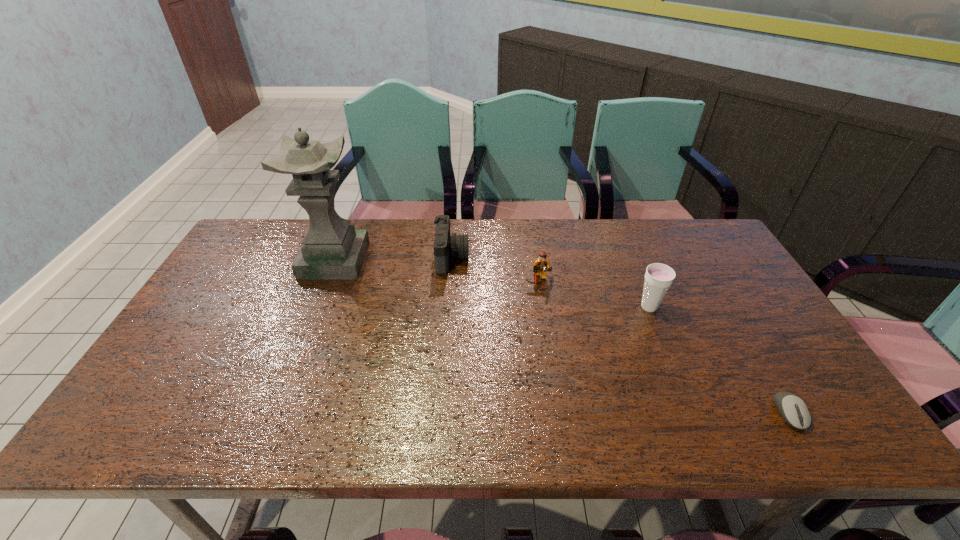
In the image, there is a desktop. Identify the location of vacant space at the left edge. (179, 376).

At what (x,y) coordinates should I click in order to perform the action: click on blank area at the right edge. Please return your answer as a coordinate pair (x, y). This screenshot has height=540, width=960. Looking at the image, I should click on (729, 326).

Where is `vacant space at the far right corner`? The width and height of the screenshot is (960, 540). vacant space at the far right corner is located at coordinates (730, 260).

Where is `empty space that is in between the rightmost object and the second object from left to right`? empty space that is in between the rightmost object and the second object from left to right is located at coordinates (620, 335).

Locate an element on the screen. The image size is (960, 540). vacant space that is in between the Lego and the fourth object from right to left is located at coordinates (495, 269).

Locate an element on the screen. The width and height of the screenshot is (960, 540). vacant space that's between the fourth tallest object and the second object from right to left is located at coordinates (593, 294).

This screenshot has height=540, width=960. I want to click on free space between the cup and the second shortest object, so click(x=593, y=294).

This screenshot has width=960, height=540. I want to click on unoccupied area between the computer equipment and the camera, so click(x=620, y=335).

At what (x,y) coordinates should I click in order to perform the action: click on vacant space in between the fourth tallest object and the camera. Please return your answer as a coordinate pair (x, y). The height and width of the screenshot is (540, 960). Looking at the image, I should click on (495, 269).

Locate an element on the screen. The image size is (960, 540). vacant region between the fourth tallest object and the camera is located at coordinates (495, 269).